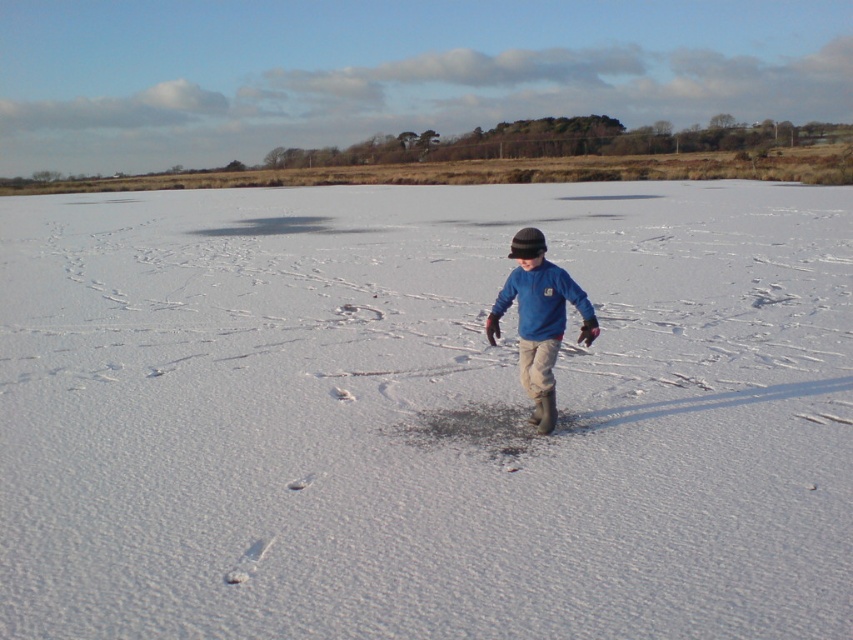
Does white powdery snow at center have a greater height compared to blue fleece at center?

Yes, white powdery snow at center is taller than blue fleece at center.

Can you confirm if white powdery snow at center is positioned below blue fleece at center?

No.

Who is more forward, (x=630, y=298) or (x=524, y=342)?

Positioned in front is point (x=524, y=342).

Identify the location of white powdery snow at center. This screenshot has height=640, width=853. (x=422, y=410).

The width and height of the screenshot is (853, 640). What are the coordinates of `white powdery snow at center` in the screenshot? It's located at (422, 410).

In the scene shown: Between white powdery snow at center and blue fleece jacket at center, which one appears on the left side from the viewer's perspective?

Positioned to the left is white powdery snow at center.

What do you see at coordinates (422, 410) in the screenshot?
I see `white powdery snow at center` at bounding box center [422, 410].

Find the location of `white powdery snow at center`. white powdery snow at center is located at coordinates (422, 410).

Does blue fleece at center have a lesser width compared to blue fleece jacket at center?

Yes.

Is blue fleece at center further to camera compared to blue fleece jacket at center?

No, blue fleece at center is in front of blue fleece jacket at center.

You are a GUI agent. You are given a task and a screenshot of the screen. Output one action in this format:
    pyautogui.click(x=<x>, y=<y>)
    Task: Click on the blue fleece at center
    Image resolution: width=853 pixels, height=640 pixels.
    Given the screenshot: What is the action you would take?
    pyautogui.click(x=538, y=320)

What are the coordinates of `blue fleece at center` in the screenshot? It's located at (538, 320).